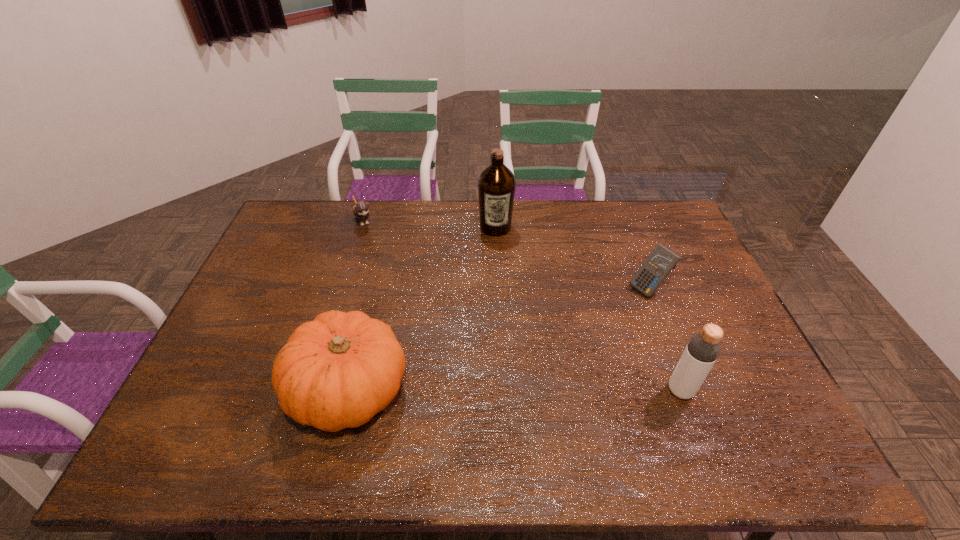
Locate an element on the screen. The width and height of the screenshot is (960, 540). pumpkin that is at the near edge is located at coordinates (337, 371).

This screenshot has height=540, width=960. Find the location of `bottle present at the near edge`. bottle present at the near edge is located at coordinates (703, 349).

At what (x,y) coordinates should I click in order to perform the action: click on object present at the right edge. Please return your answer as a coordinate pair (x, y). The height and width of the screenshot is (540, 960). Looking at the image, I should click on (661, 261).

Identify the location of vacant space at the far edge of the desktop. (387, 225).

Locate an element on the screen. vacant region at the near edge of the desktop is located at coordinates (663, 392).

This screenshot has height=540, width=960. I want to click on free region at the left edge of the desktop, so click(x=246, y=363).

You are a GUI agent. You are given a task and a screenshot of the screen. Output one action in this format:
    pyautogui.click(x=<x>, y=<y>)
    Task: Click on the free region at the right edge of the desktop
    
    Given the screenshot: What is the action you would take?
    pyautogui.click(x=698, y=267)

The width and height of the screenshot is (960, 540). In the image, there is a desktop. In order to click on vacant space at the near left corner in this screenshot , I will do `click(228, 403)`.

Identify the location of free space at the far right corner of the desktop. (671, 227).

Where is `unoccupied area between the shortest object and the pumpkin`? This screenshot has width=960, height=540. unoccupied area between the shortest object and the pumpkin is located at coordinates (356, 305).